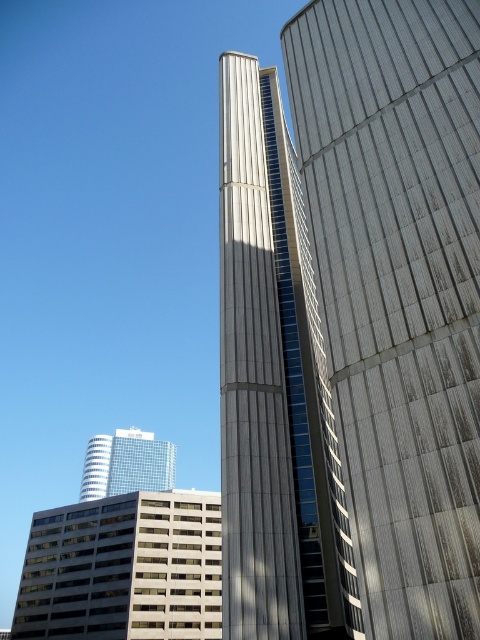
You are an architect evaluating the urban layout. Considering the spatial relationship between the gray concrete tower at center and the glass windows building at center, which one appears to be closer to the observer based on their sizes in the image?

The gray concrete tower at center is smaller than the glass windows building at center, so it appears farther away from the observer since smaller objects in perspective are typically farther away.

You are an architect analyzing the urban layout. You need to determine the spatial relationship between the gray textured building at right and the gray concrete tower at center. Which building is located to the right of the other?

The gray textured building at right is positioned on the right side of the gray concrete tower at center.

You are an architect analyzing the urban layout of this city. You observe the gray concrete tower at center and the clear glass skyscraper at center. Which building would require a narrower foundation to support its structure?

The gray concrete tower at center has a lesser width compared to the clear glass skyscraper at center, so it would require a narrower foundation to support its structure.